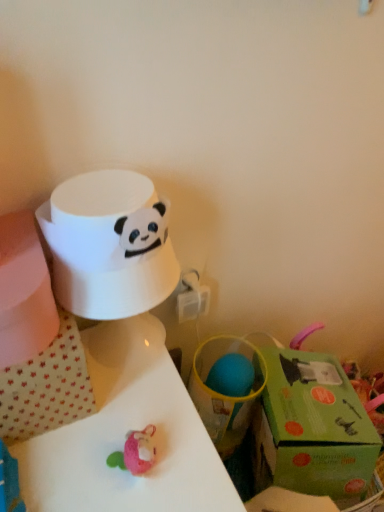
Image resolution: width=384 pixels, height=512 pixels. I want to click on free space in front of white matte paper towel at upper left, so click(x=133, y=437).